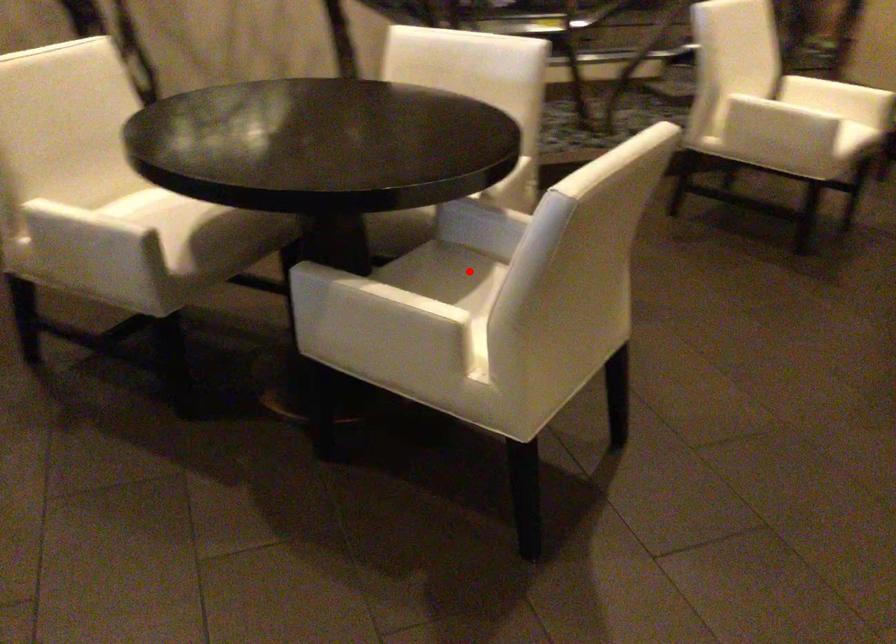
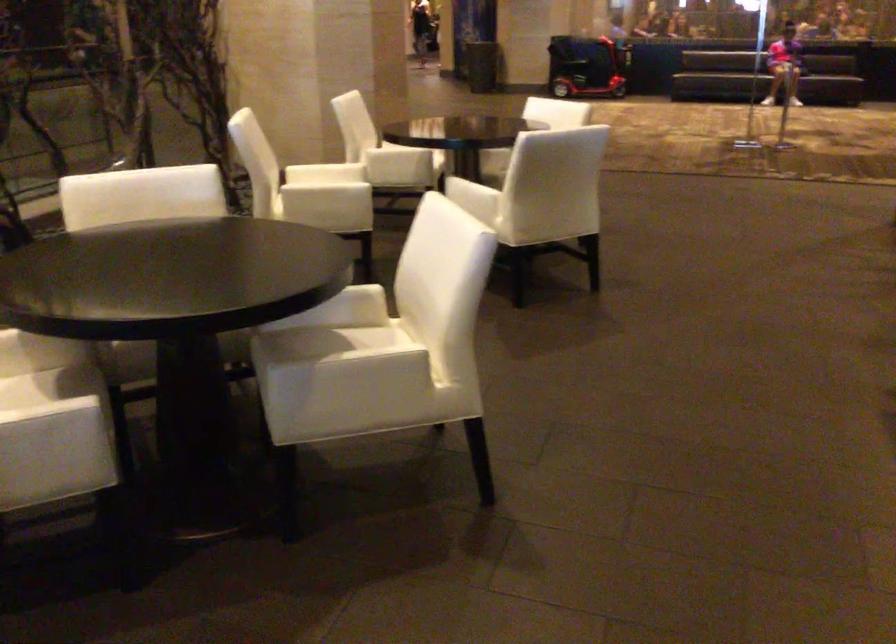
Question: I am providing you with two images of the same scene from different viewpoints. Given a red point in image1, look at the same physical point in image2. Is it:

Choices:
 (A) Closer to the viewpoint
 (B) Farther from the viewpoint

Answer: (B)